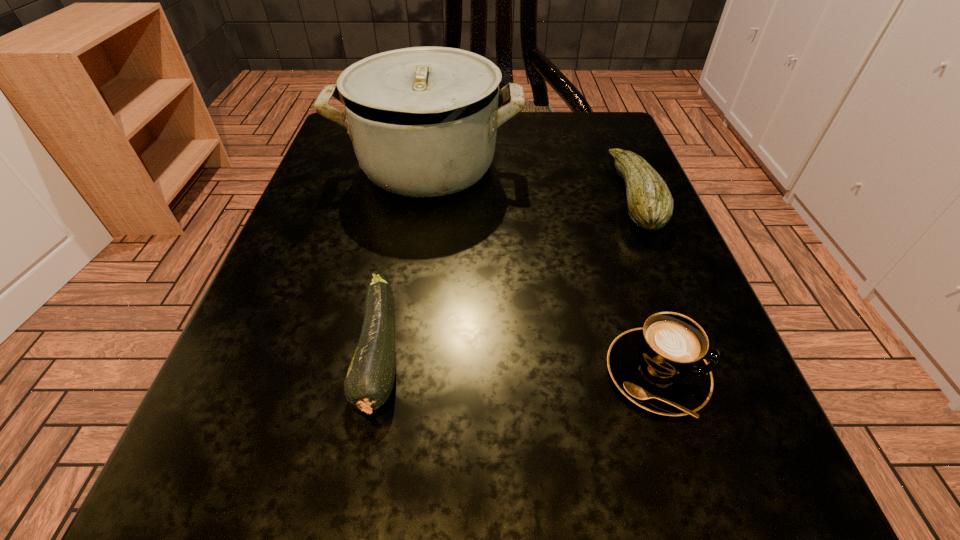
This screenshot has height=540, width=960. I want to click on free space at the left edge of the desktop, so click(385, 219).

Where is `free space at the right edge of the desktop`? The height and width of the screenshot is (540, 960). free space at the right edge of the desktop is located at coordinates (629, 278).

This screenshot has width=960, height=540. In the image, there is a desktop. In order to click on vacant area at the far right corner in this screenshot , I will do `click(554, 164)`.

Image resolution: width=960 pixels, height=540 pixels. Find the location of `vacant region between the tallest object and the cappuccino`. vacant region between the tallest object and the cappuccino is located at coordinates (542, 271).

At what (x,y) coordinates should I click in order to perform the action: click on free space between the cappuccino and the shortest object. Please return your answer as a coordinate pair (x, y). Looking at the image, I should click on point(518,364).

Identify the location of free space between the shortest object and the farther zucchini. The height and width of the screenshot is (540, 960). (507, 275).

Identify the location of blank region between the nearer zucchini and the cappuccino. (518, 364).

The height and width of the screenshot is (540, 960). I want to click on vacant point located between the taller zucchini and the shortest object, so click(507, 275).

The image size is (960, 540). Find the location of `free space that is in between the nearer zucchini and the cappuccino`. free space that is in between the nearer zucchini and the cappuccino is located at coordinates (518, 364).

This screenshot has width=960, height=540. I want to click on unoccupied area between the cappuccino and the saucepan, so click(542, 271).